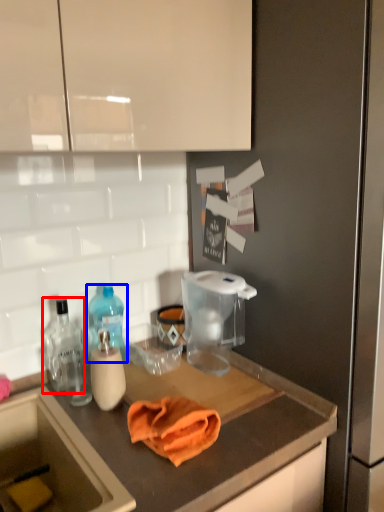
Question: Which object appears farthest to the camera in this image, bottle (highlighted by a red box) or bottle (highlighted by a blue box)?

Choices:
 (A) bottle
 (B) bottle

Answer: (B)